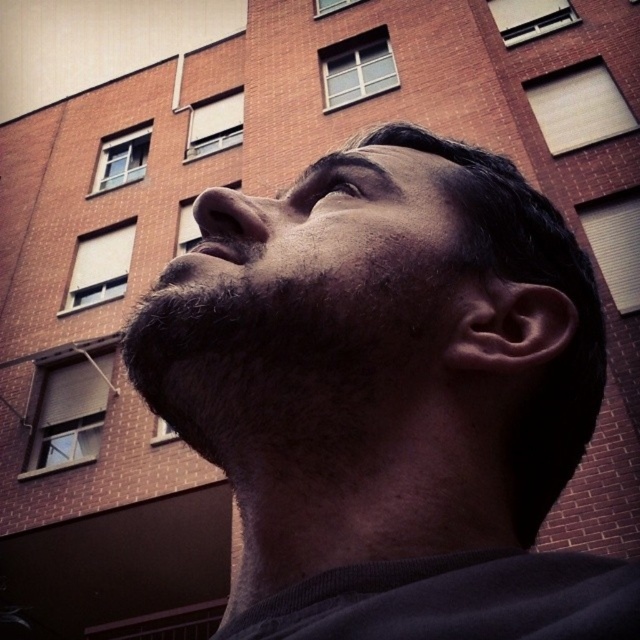
You are a photographer adjusting the focus on your camera. You want to ensure both the dark beard at center and the brown matte eye at upper center are in sharp focus. Given the depth of field, what is the minimum distance the camera should be focused at to achieve this?

The minimum focusing distance should be set to 3.57 inches to ensure both the dark beard at center and the brown matte eye at upper center are in focus, as they are separated by that distance.

You are a photographer adjusting the camera settings to focus on the dark hair at center and the dark beard at center. Which object should you focus on first if you want to capture both in sharp detail?

The dark hair at center is taller than the dark beard at center. To capture both in sharp detail, focus on the dark hair at center first since it is farther from the camera, ensuring the depth of field includes both.

You are a photographer adjusting the focus on your camera. You notice a point at coordinates (390, 397) in the image. Based on the scene description, where is this point located?

The point at coordinates (390, 397) is located on the dark hair at center.